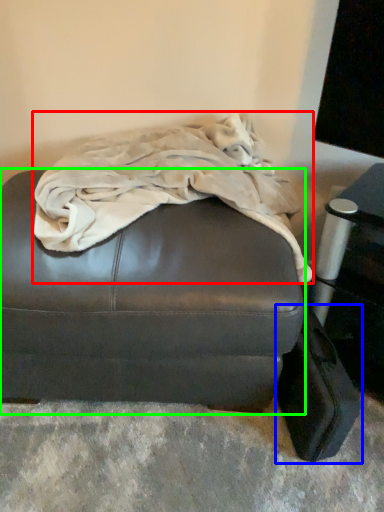
Question: Which object is the farthest from blanket (highlighted by a red box)? Choose among these: luggage (highlighted by a blue box) or furniture (highlighted by a green box).

Choices:
 (A) luggage
 (B) furniture

Answer: (A)